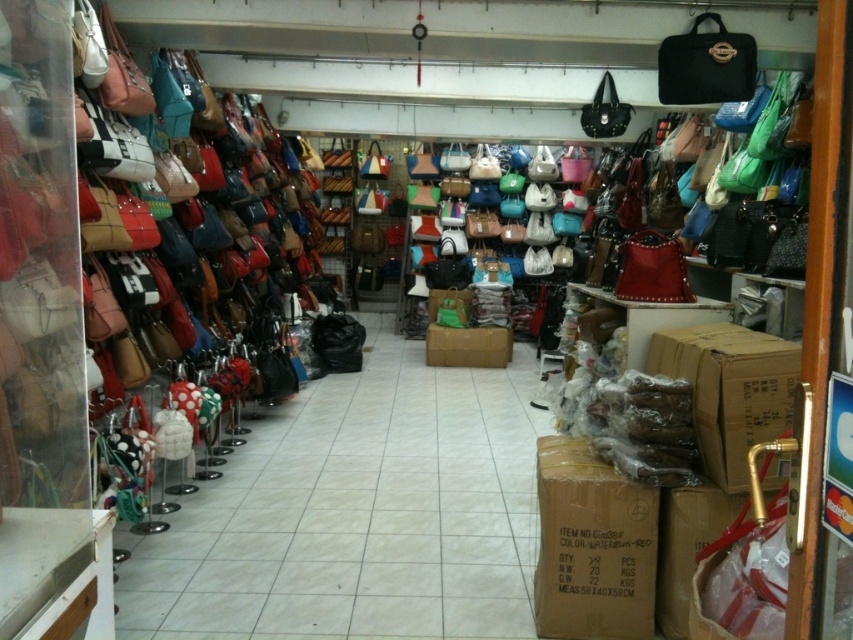
Question: Which of the following is the closest to the observer?

Choices:
 (A) waterproof cardboard box at center
 (B) brown cardboard box at center
 (C) waterproof-red cardboard box at lower right
 (D) brown cardboard box at lower right

Answer: (C)

Question: Which point is farther from the camera taking this photo?

Choices:
 (A) (555, 452)
 (B) (672, 548)
 (C) (790, 352)
 (D) (506, 353)

Answer: (D)

Question: Is waterproof-red cardboard box at lower right closer to the viewer compared to brown cardboard box at center?

Choices:
 (A) yes
 (B) no

Answer: (A)

Question: Is the position of brown cardboard box at lower right less distant than that of waterproof-red cardboard box at lower right?

Choices:
 (A) no
 (B) yes

Answer: (A)

Question: Among these points, which one is farthest from the camera?

Choices:
 (A) (718, 502)
 (B) (556, 604)

Answer: (B)

Question: Is waterproof cardboard box at center smaller than brown cardboard box at lower right?

Choices:
 (A) no
 (B) yes

Answer: (A)